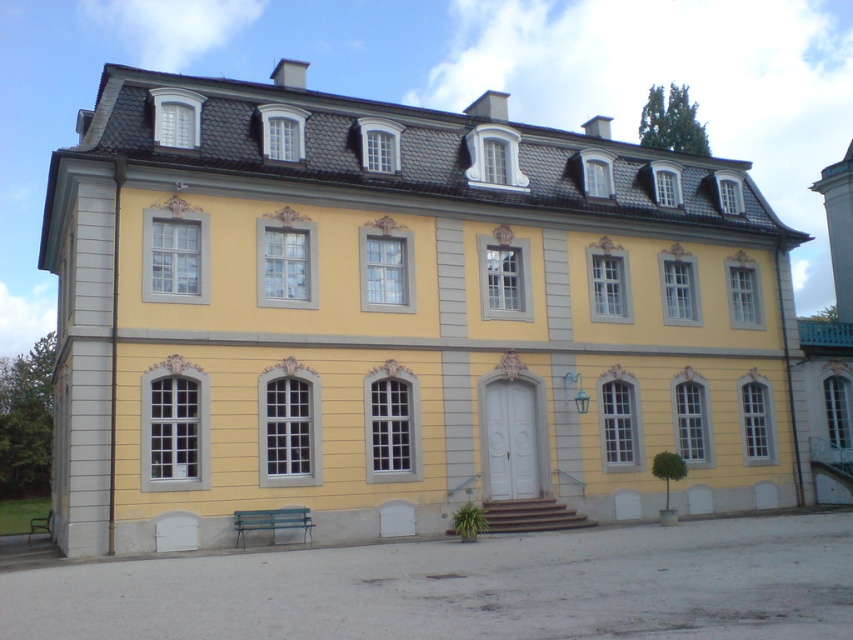
You are a visitor standing at the entrance of the two story building and want to sit down. You see the green painted wood bench at lower left and the green wooden bench at lower left. Which one is closer to you?

Both the green painted wood bench at lower left and the green wooden bench at lower left are actually the same bench. The distance between them is 13.35 meters, which suggests they might be duplicates or there is a misunderstanding in their placement.

You are planning to place a new bench in the courtyard of the building. You have two options available, the green painted wood bench at lower left and the green wooden bench at lower left. Which bench should you choose if you want the one that takes up less space?

The green painted wood bench at lower left is smaller than the green wooden bench at lower left, so you should choose the green painted wood bench at lower left if you want the one that takes up less space.

You are standing in front of the two story building and want to reach a specific point marked at coordinate point (302,509). If you are currently 100 feet away from the building, will you have to walk towards or away from the building to reach that point?

The distance of point (302,509) from viewer is 96.63 feet. Since you are currently 100 feet away from the building, you need to walk towards the building by 3.37 feet to reach the point.